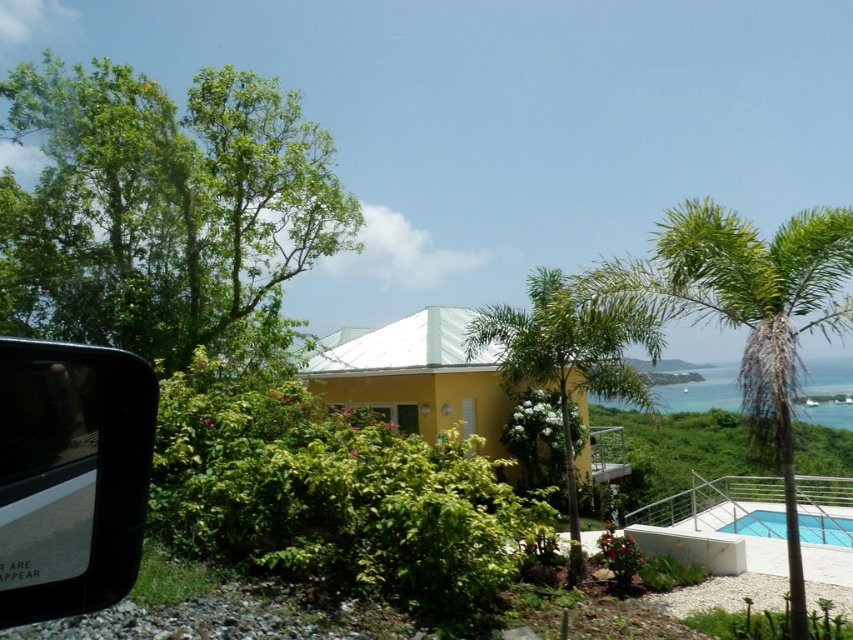
Is transparent glass car window at lower left taller than transparent glass pool at lower right?

Indeed, transparent glass car window at lower left has a greater height compared to transparent glass pool at lower right.

Does point (70, 365) lie in front of point (845, 541)?

Yes, it is in front of point (845, 541).

You are a GUI agent. You are given a task and a screenshot of the screen. Output one action in this format:
    pyautogui.click(x=<x>, y=<y>)
    Task: Click on the transparent glass car window at lower left
    The height and width of the screenshot is (640, 853).
    Given the screenshot: What is the action you would take?
    pyautogui.click(x=71, y=476)

Does transparent glass car window at lower left have a larger size compared to green leafy palm tree at center?

No.

The height and width of the screenshot is (640, 853). Identify the location of transparent glass car window at lower left. (71, 476).

Can you confirm if green leafy tree at upper left is smaller than green leafy palm tree at upper right?

Indeed, green leafy tree at upper left has a smaller size compared to green leafy palm tree at upper right.

Is green leafy tree at upper left thinner than green leafy palm tree at upper right?

Indeed, green leafy tree at upper left has a lesser width compared to green leafy palm tree at upper right.

The image size is (853, 640). What are the coordinates of `green leafy tree at upper left` in the screenshot? It's located at (165, 208).

The height and width of the screenshot is (640, 853). Find the location of `green leafy tree at upper left`. green leafy tree at upper left is located at coordinates (165, 208).